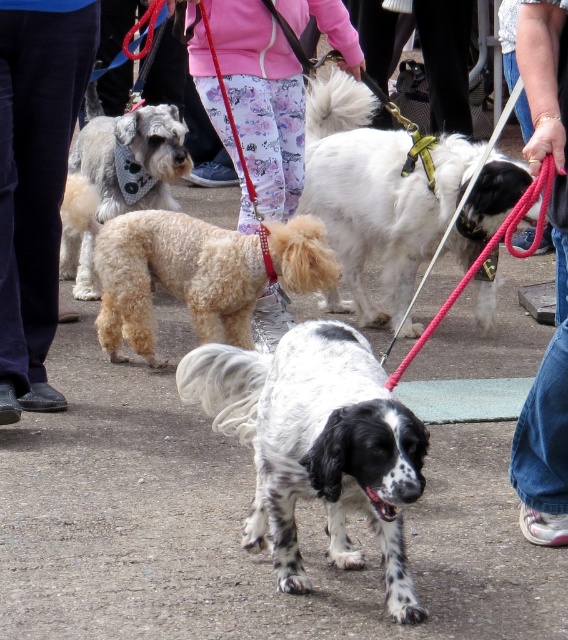
Who is more forward, (540, 80) or (110, 163)?

Positioned in front is point (540, 80).

Who is positioned more to the left, jeans at lower right or fuzzy beige dog at upper left?

fuzzy beige dog at upper left

Where is `jeans at lower right`? jeans at lower right is located at coordinates (556, 280).

Does jeans at lower right have a larger size compared to rope leash at center?

No, jeans at lower right is not bigger than rope leash at center.

Can you confirm if jeans at lower right is thinner than rope leash at center?

Correct, jeans at lower right's width is less than rope leash at center's.

I want to click on jeans at lower right, so click(556, 280).

Who is lower down, speckled fur dog at center or fuzzy beige dog at upper left?

Positioned lower is speckled fur dog at center.

Does speckled fur dog at center have a larger size compared to fuzzy beige dog at upper left?

Incorrect, speckled fur dog at center is not larger than fuzzy beige dog at upper left.

Between point (306, 452) and point (165, 166), which one is positioned behind?

The point (165, 166) is behind.

Find the location of `speckled fur dog at center`. speckled fur dog at center is located at coordinates (316, 445).